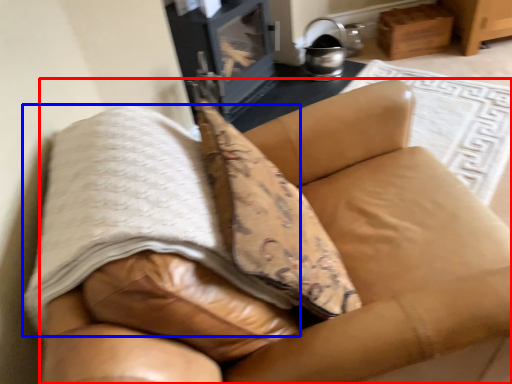
Question: Which point is further to the camera, furniture (highlighted by a red box) or blanket (highlighted by a blue box)?

Choices:
 (A) furniture
 (B) blanket

Answer: (B)